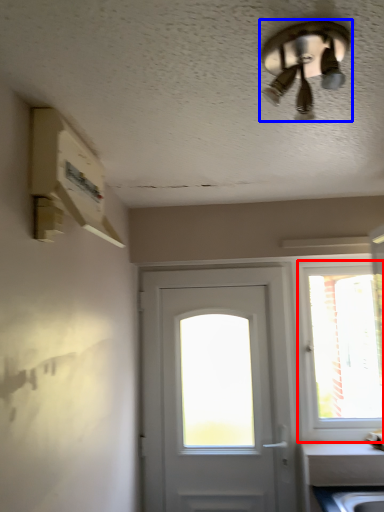
Question: Which of the following is the closest to the observer, window (highlighted by a red box) or ceiling fan (highlighted by a blue box)?

Choices:
 (A) window
 (B) ceiling fan

Answer: (B)